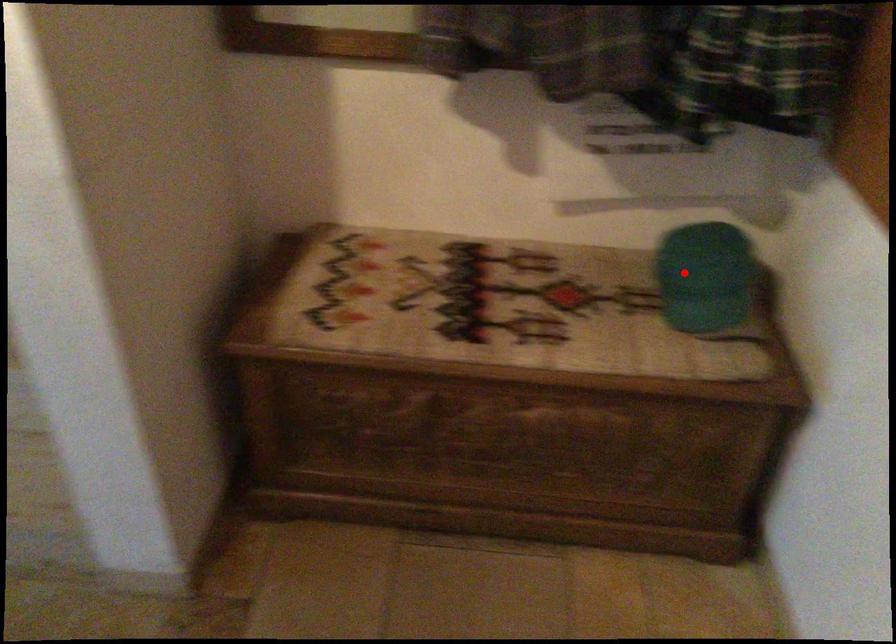
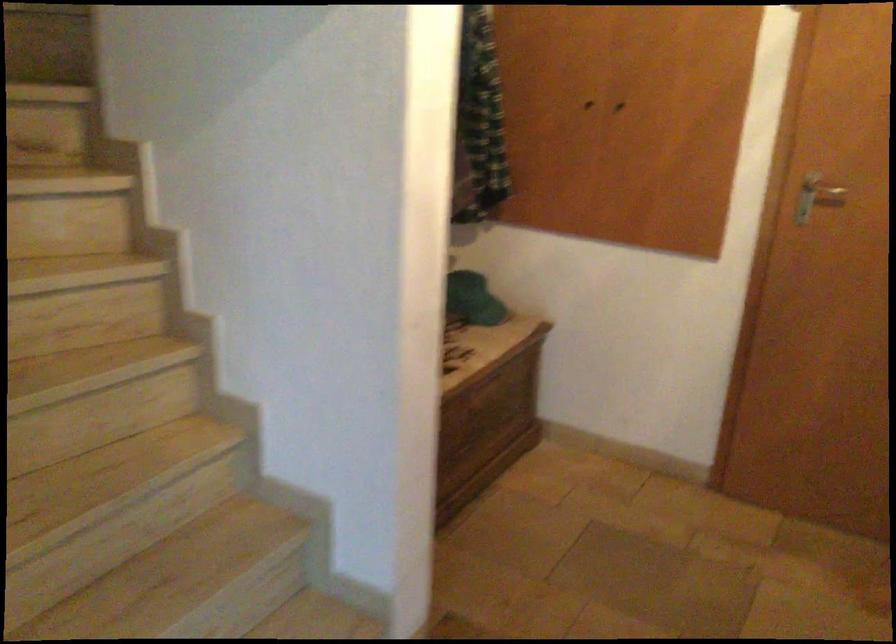
In the second image, find the point that corresponds to the highlighted location in the first image.

(472, 299)